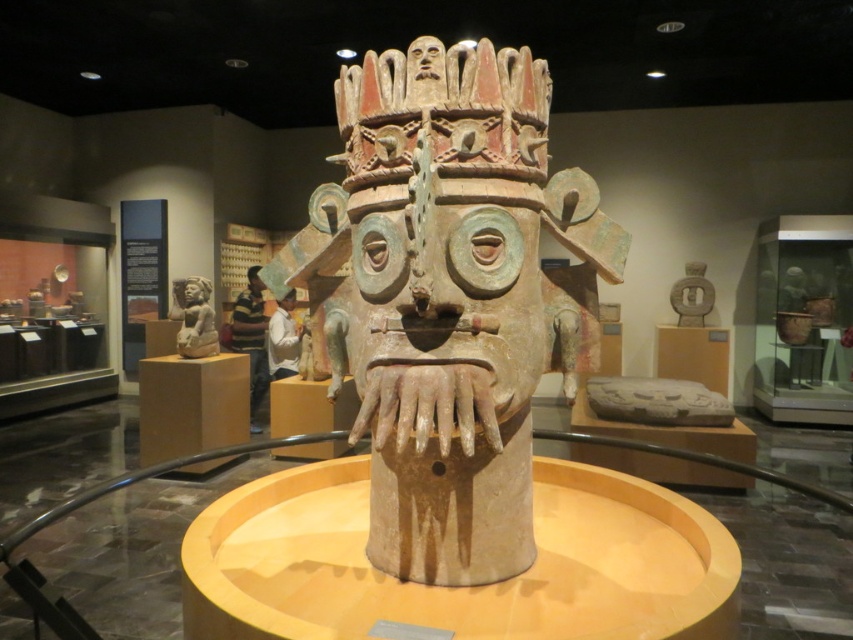
Can you confirm if striped shirt at center is positioned below white matte shirt at center?

Yes.

Between striped shirt at center and white matte shirt at center, which one appears on the left side from the viewer's perspective?

Positioned to the left is striped shirt at center.

This screenshot has width=853, height=640. What do you see at coordinates (251, 339) in the screenshot? I see `striped shirt at center` at bounding box center [251, 339].

The image size is (853, 640). I want to click on striped shirt at center, so click(x=251, y=339).

Who is more distant from viewer, (433, 451) or (215, 330)?

Point (215, 330)

Which of these two, matte clay mask at center or matte brown statue at left, stands shorter?

matte brown statue at left is shorter.

Is point (502, 232) closer to viewer compared to point (209, 284)?

Yes.

Identify the location of matte clay mask at center. This screenshot has height=640, width=853. (450, 296).

Which is more to the right, matte clay mask at center or white matte shirt at center?

Positioned to the right is matte clay mask at center.

In order to click on matte clay mask at center in this screenshot , I will do `click(450, 296)`.